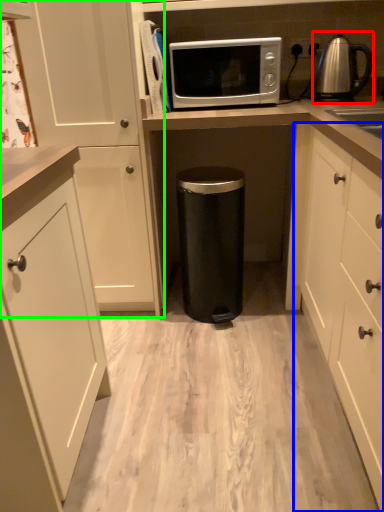
Question: Considering the real-world distances, which object is closest to kettle (highlighted by a red box)? cabinetry (highlighted by a blue box) or cabinetry (highlighted by a green box).

Choices:
 (A) cabinetry
 (B) cabinetry

Answer: (A)